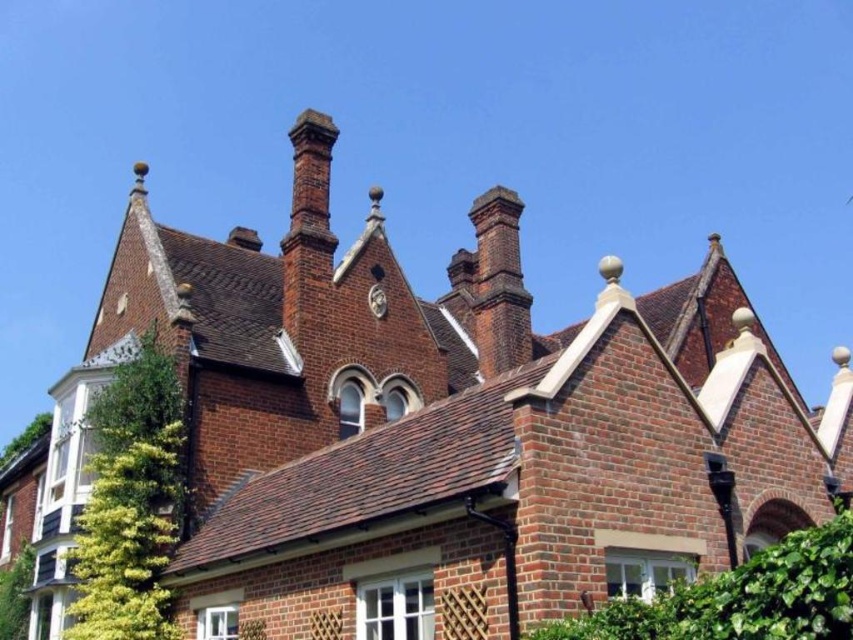
Question: Where is green leafy hedge at lower right located in relation to red brick chimney at upper center in the image?

Choices:
 (A) left
 (B) right

Answer: (B)

Question: From the image, what is the correct spatial relationship of green leafy ivy at left in relation to green leafy hedge at lower right?

Choices:
 (A) right
 (B) left

Answer: (B)

Question: Which point is closer to the camera?

Choices:
 (A) red brick chimney at upper center
 (B) green leafy hedge at lower right
 (C) green leafy ivy at left

Answer: (B)

Question: Which is farther from the red brick chimney at upper center?

Choices:
 (A) green leafy ivy at left
 (B) green leafy hedge at lower right

Answer: (B)

Question: Is green leafy ivy at left closer to the viewer compared to green leafy hedge at lower right?

Choices:
 (A) yes
 (B) no

Answer: (B)

Question: Among these objects, which one is nearest to the camera?

Choices:
 (A) green leafy hedge at lower right
 (B) red brick chimney at upper center

Answer: (A)